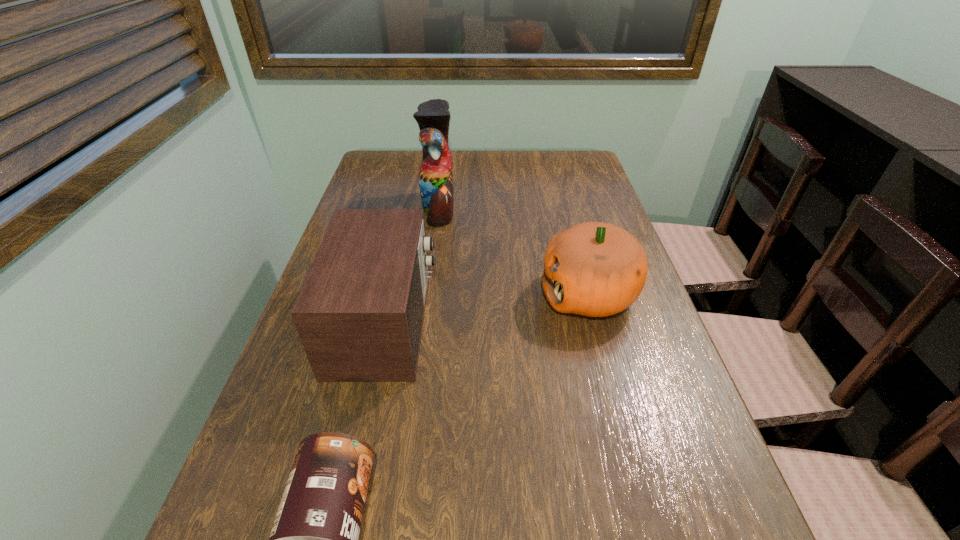
Locate an element on the screen. The width and height of the screenshot is (960, 540). object at the right edge is located at coordinates (596, 269).

Identify the location of free space at the far edge of the desktop. (420, 155).

At what (x,y) coordinates should I click in order to perform the action: click on free space at the left edge of the desktop. Please return your answer as a coordinate pair (x, y). Looking at the image, I should click on (367, 195).

Locate an element on the screen. This screenshot has height=540, width=960. vacant space at the right edge of the desktop is located at coordinates (599, 319).

Find the location of `vacant space at the far left corner of the desktop`. vacant space at the far left corner of the desktop is located at coordinates (411, 154).

Identify the location of blank space at the far right corner. This screenshot has height=540, width=960. (579, 177).

Where is `unoccupied position between the pumpkin and the radio receiver`? unoccupied position between the pumpkin and the radio receiver is located at coordinates (487, 308).

Identify the location of free spot between the rightmost object and the radio receiver. tap(487, 308).

The width and height of the screenshot is (960, 540). I want to click on vacant region between the rightmost object and the radio receiver, so click(x=487, y=308).

The image size is (960, 540). Find the location of `empty location between the rightmost object and the farthest object`. empty location between the rightmost object and the farthest object is located at coordinates tap(514, 251).